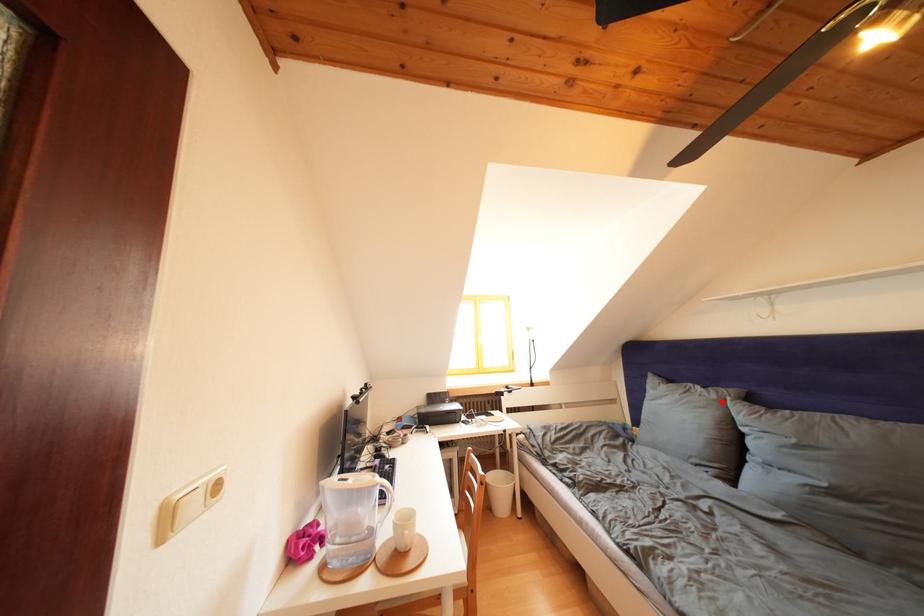
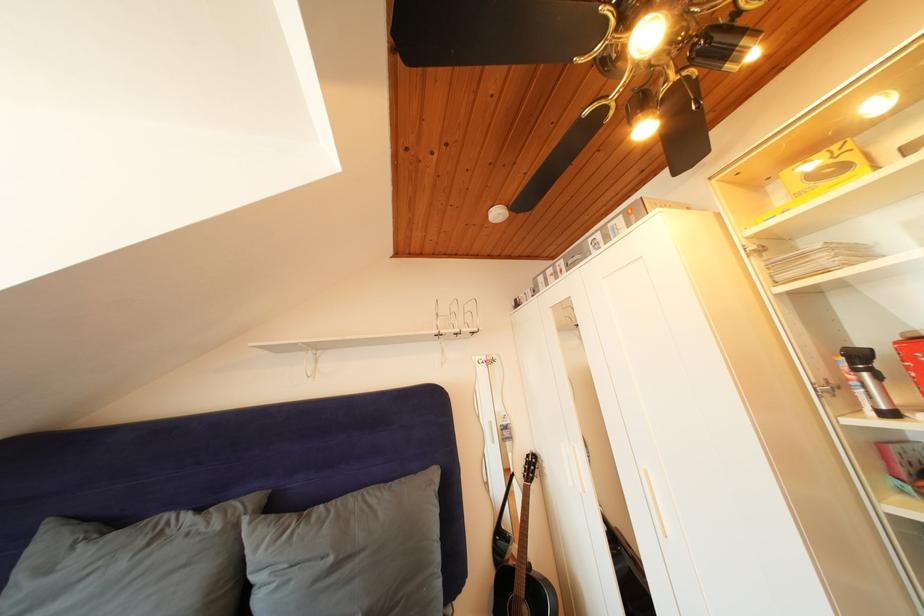
Where in the second image is the point corresponding to the highlighted location from the first image?

(225, 531)